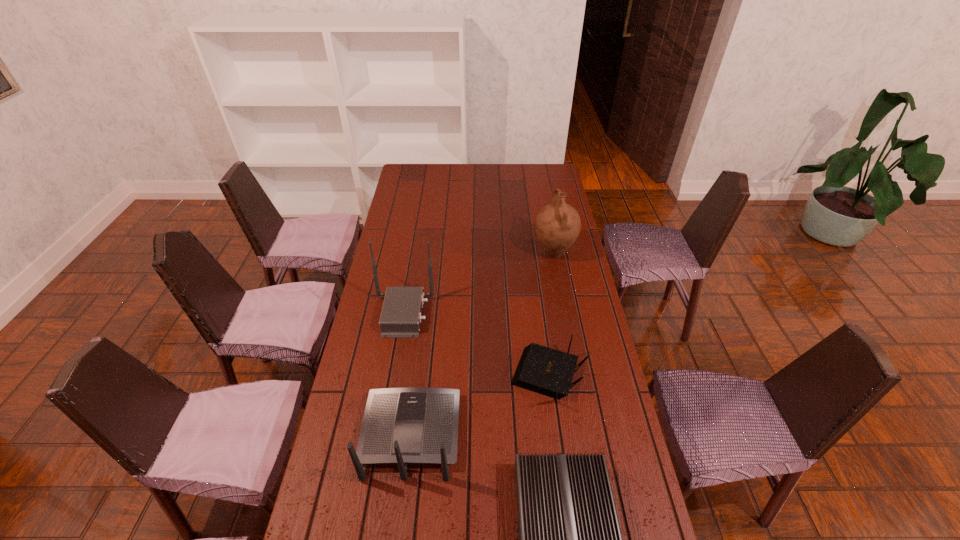
This screenshot has width=960, height=540. I want to click on the farthest object, so click(x=557, y=226).

Locate an element on the screen. The width and height of the screenshot is (960, 540). the farthest router is located at coordinates [401, 316].

The image size is (960, 540). Identify the location of the tallest router. (401, 316).

At what (x,y) coordinates should I click in order to perform the action: click on the third shortest router. Please return your answer as a coordinate pair (x, y). Looking at the image, I should click on (401, 426).

I want to click on vacant region located on the back of the farthest object, so click(x=543, y=199).

I want to click on vacant region located on the back of the tallest router to connect cables, so click(531, 314).

You are a GUI agent. You are given a task and a screenshot of the screen. Output one action in this format:
    pyautogui.click(x=<x>, y=<y>)
    Task: Click on the vacant position located 0.360m on the front-facing side of the second tallest router
    
    Given the screenshot: What is the action you would take?
    pyautogui.click(x=426, y=310)

At what (x,y) coordinates should I click in order to perform the action: click on blank area located on the front-facing side of the second tallest router. Please return your answer as a coordinate pair (x, y). Image resolution: width=960 pixels, height=540 pixels. Looking at the image, I should click on (423, 335).

Find the location of a particular element. The image size is (960, 540). vacant region located 0.280m on the front-facing side of the second tallest router is located at coordinates click(x=424, y=327).

What are the coordinates of `pitcher situated at the right edge` in the screenshot? It's located at (557, 226).